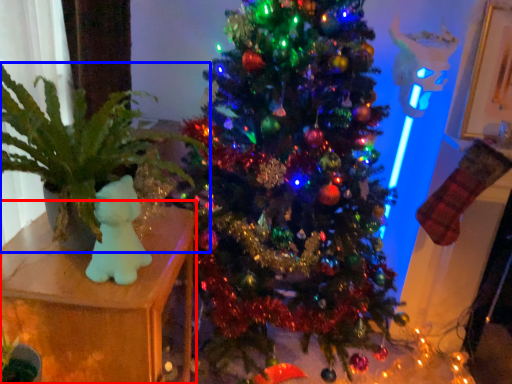
Question: Which object is closer to the camera taking this photo, furniture (highlighted by a red box) or houseplant (highlighted by a blue box)?

Choices:
 (A) furniture
 (B) houseplant

Answer: (B)